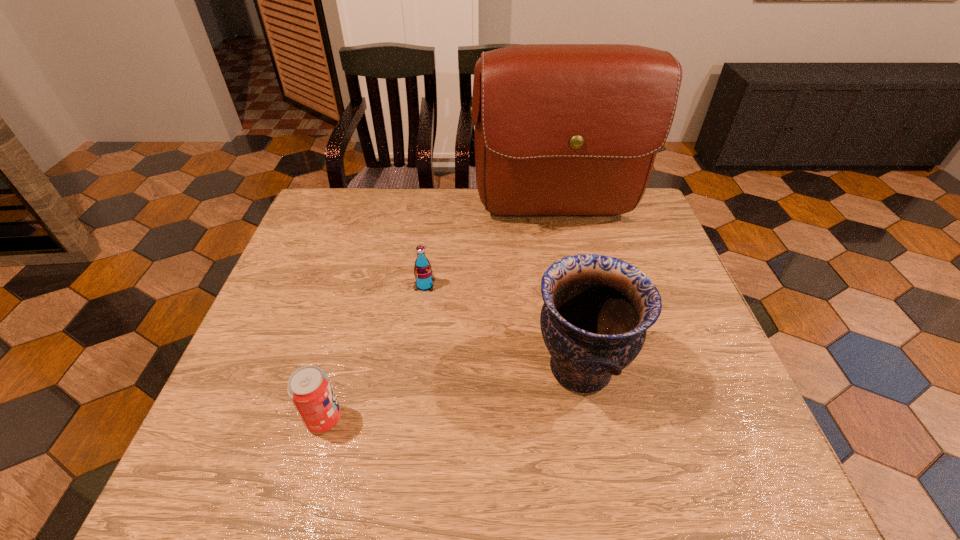
Locate an element on the screen. The image size is (960, 540). the farthest object is located at coordinates (561, 130).

Identify the location of satchel. The width and height of the screenshot is (960, 540). (561, 130).

At what (x,y) coordinates should I click in order to perform the action: click on the second tallest object. Please return your answer as a coordinate pair (x, y). This screenshot has height=540, width=960. Looking at the image, I should click on (597, 309).

Identify the location of the nearer soda. The width and height of the screenshot is (960, 540). point(309,388).

You are a GUI agent. You are given a task and a screenshot of the screen. Output one action in this format:
    pyautogui.click(x=<x>, y=<y>)
    Task: Click on the left soda
    This screenshot has width=960, height=540.
    Given the screenshot: What is the action you would take?
    pyautogui.click(x=309, y=388)

Where is `the farther soda`? The width and height of the screenshot is (960, 540). the farther soda is located at coordinates (423, 273).

The height and width of the screenshot is (540, 960). In order to click on the right soda in this screenshot , I will do `click(423, 273)`.

Find the location of `vacant space located 0.100m on the open flap of the farthest object`. vacant space located 0.100m on the open flap of the farthest object is located at coordinates (567, 265).

Where is `free spot located 0.100m on the front handle of the pottery`? This screenshot has height=540, width=960. free spot located 0.100m on the front handle of the pottery is located at coordinates (486, 368).

I want to click on free space located 0.240m on the front handle of the pottery, so click(422, 368).